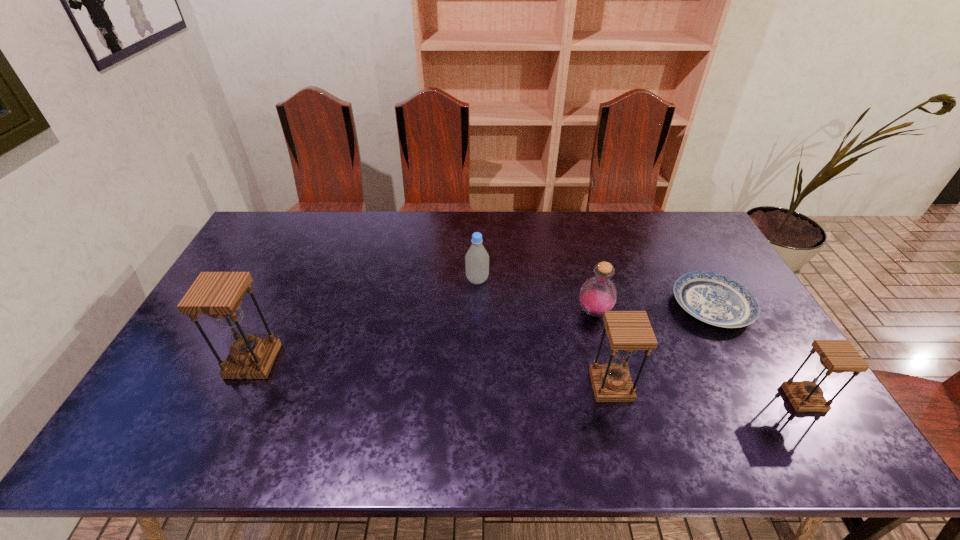
Identify the location of vacant area situated on the left of the second tallest hourglass. Image resolution: width=960 pixels, height=540 pixels. (483, 386).

Identify the location of vacant area situated 0.050m on the left of the shortest hourglass. Image resolution: width=960 pixels, height=540 pixels. (768, 399).

Locate an element on the screen. Image resolution: width=960 pixels, height=540 pixels. vacant space located 0.250m on the left of the plate is located at coordinates (590, 306).

In order to click on vacant space located 0.300m on the left of the farther bottle in this screenshot , I will do `click(373, 280)`.

I want to click on vacant space located on the left of the nearer bottle, so click(x=499, y=312).

Where is `object that is positioned at the left edge`? The height and width of the screenshot is (540, 960). object that is positioned at the left edge is located at coordinates (219, 295).

Where is `hourglass at the right edge`? hourglass at the right edge is located at coordinates (836, 356).

Locate an element on the screen. The height and width of the screenshot is (540, 960). plate situated at the right edge is located at coordinates (715, 299).

In order to click on object located in the near right corner section of the desktop in this screenshot , I will do coord(836,356).

You are a GUI agent. You are given a task and a screenshot of the screen. Output one action in this format:
    pyautogui.click(x=<x>, y=<y>)
    Task: Click on the vacant position at the far edge of the desktop
    This screenshot has height=540, width=960.
    Given the screenshot: What is the action you would take?
    pyautogui.click(x=427, y=219)